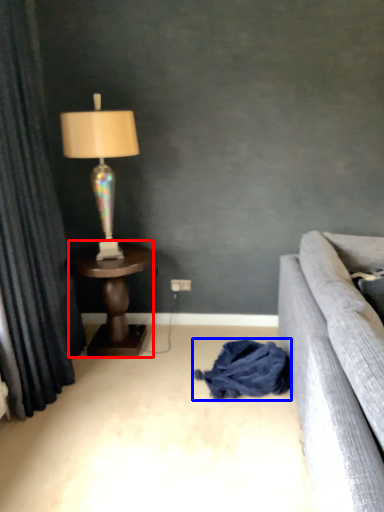
Question: Among these objects, which one is nearest to the camera, table (highlighted by a red box) or material (highlighted by a blue box)?

Choices:
 (A) table
 (B) material

Answer: (B)